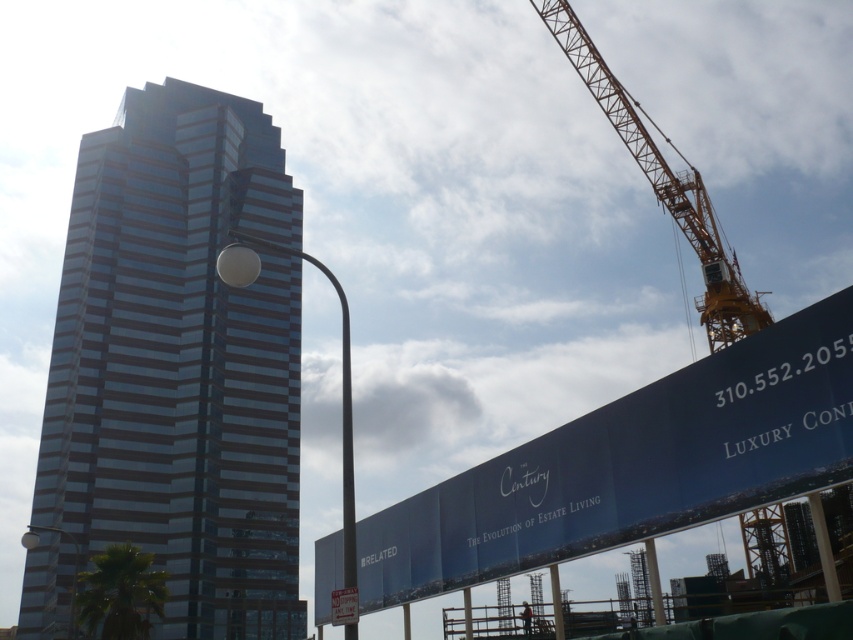
You are standing in the urban scene described. There is a point at coordinates point (248, 211). Can you determine if this point is within the construction site area on the right side of the image?

The point (248, 211) is 410.68 feet away from the viewer, so it is likely within the construction site area on the right side of the image since it is positioned further away compared to the highrise building on the left.

You are standing at the camera position and want to take a photo of the shiny glass skyscraper at center. The camera has a maximum zoom range of 200 feet. Can you capture the entire skyscraper in your photo without moving closer?

The shiny glass skyscraper at center is 279.76 feet away from the camera. Since the camera can only zoom up to 200 feet, it cannot capture the entire skyscraper without moving closer.

What is located at the point with coordinates (x=175, y=371) in the image?

The point at coordinates (x=175, y=371) is occupied by the shiny glass skyscraper at center.